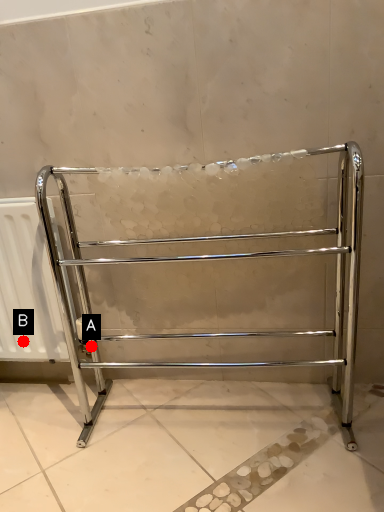
Question: Two points are circled on the image, labeled by A and B beside each circle. Which point is closer to the camera taking this photo?

Choices:
 (A) A is closer
 (B) B is closer

Answer: (B)